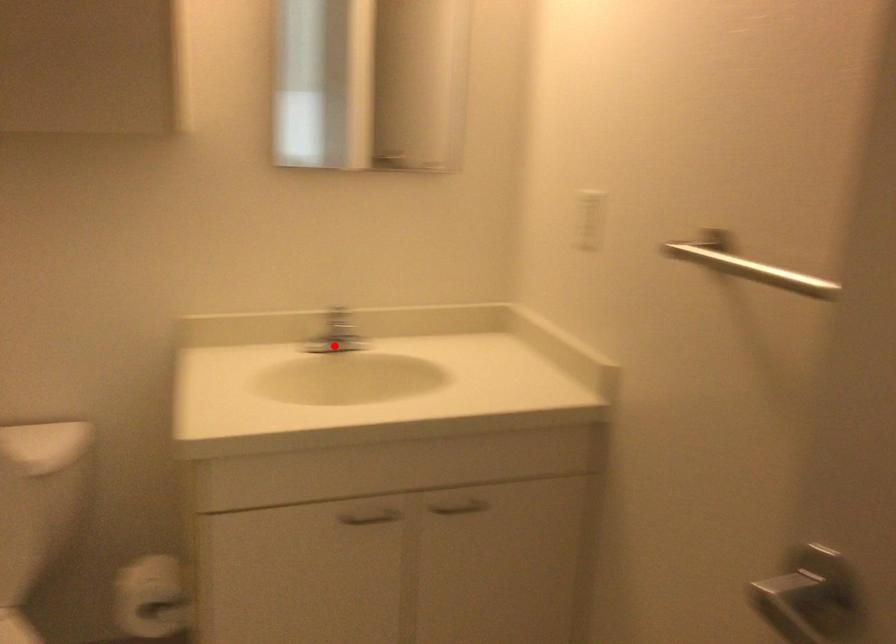
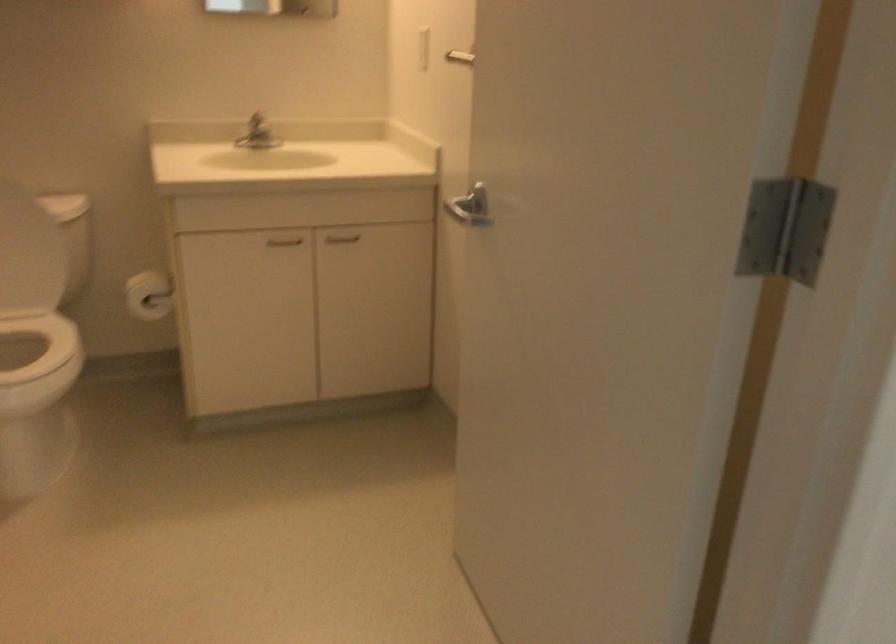
In the second image, find the point that corresponds to the highlighted location in the first image.

(255, 133)